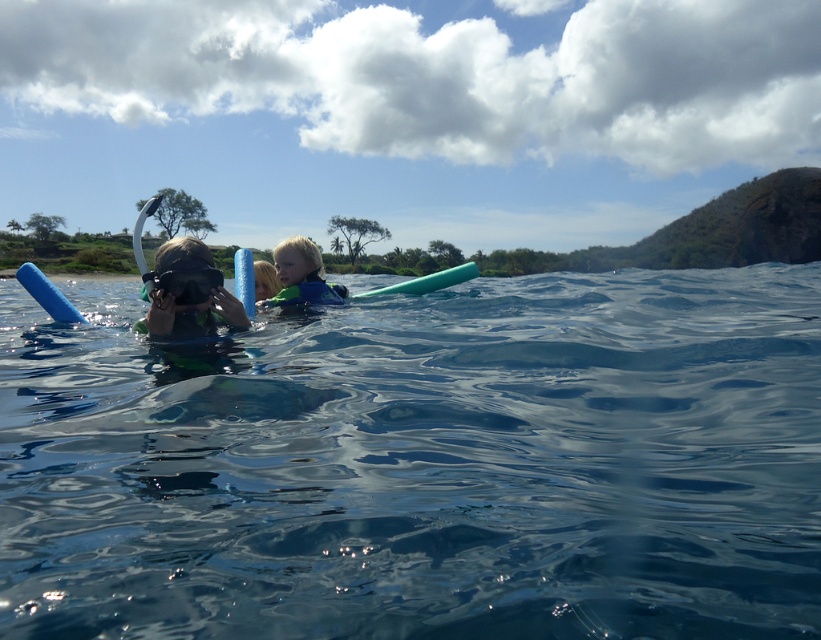
Question: Which point is farther to the camera?

Choices:
 (A) (154, 308)
 (B) (285, 282)
 (C) (420, 292)

Answer: (C)

Question: Considering the relative positions of clear blue water at center and blue rubber ring at center in the image provided, where is clear blue water at center located with respect to blue rubber ring at center?

Choices:
 (A) below
 (B) above

Answer: (B)

Question: Among these points, which one is nearest to the camera?

Choices:
 (A) (310, 275)
 (B) (184, 308)

Answer: (B)

Question: Which object is positioned closest to the matte green snorkel at center?

Choices:
 (A) clear blue water at center
 (B) blue foam paddle at upper left
 (C) blue rubber ring at center

Answer: (B)

Question: Does blue rubber ring at center appear on the left side of green foam paddle at center?

Choices:
 (A) no
 (B) yes

Answer: (B)

Question: Is blue foam paddle at upper left closer to the viewer compared to green foam paddle at center?

Choices:
 (A) yes
 (B) no

Answer: (A)